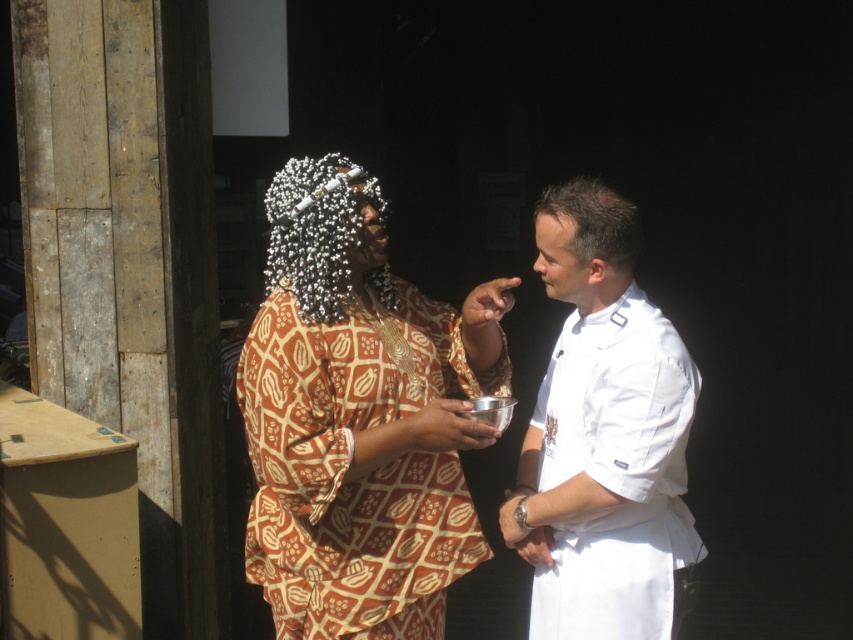
Does brown printed fabric dress at center have a lesser height compared to white smooth chef's uniform at right?

No.

Which of these two, brown printed fabric dress at center or white smooth chef's uniform at right, stands taller?

brown printed fabric dress at center is taller.

This screenshot has height=640, width=853. I want to click on brown printed fabric dress at center, so click(358, 419).

I want to click on brown printed fabric dress at center, so click(358, 419).